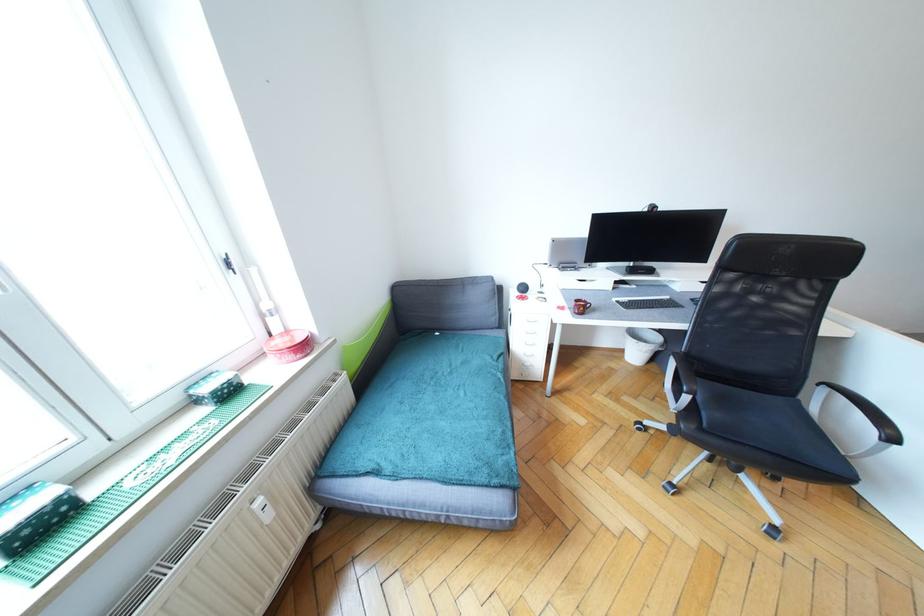
The image size is (924, 616). In order to click on black window handle in this screenshot , I will do `click(228, 262)`.